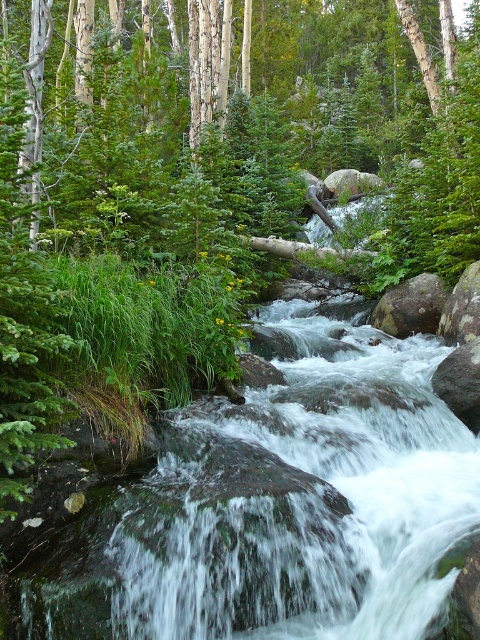
You are standing at the origin point of the image. Which direction should you move to reach the clear water at center?

The clear water at center is located at point 0.794 on the x axis and 0.577 on the y axis, so you should move towards the right and slightly upwards to reach it.

You are a hiker carrying a 1.5 meter wide backpack. You come across the stream shown in the image. Can you safely cross the stream using the clear water at center without your backpack touching the smooth gray rock at center?

The clear water at center is narrower than the smooth gray rock at center. Since your backpack is 1.5 meters wide and the water is narrower than the rock, it might not provide enough space for the backpack to pass without touching the rock. Therefore, crossing might not be safe.

You are standing at the edge of the forest stream. You see the clear water at center and the smooth gray rock at center. Which object is nearer to you?

The clear water at center is closer to the viewer than the smooth gray rock at center.